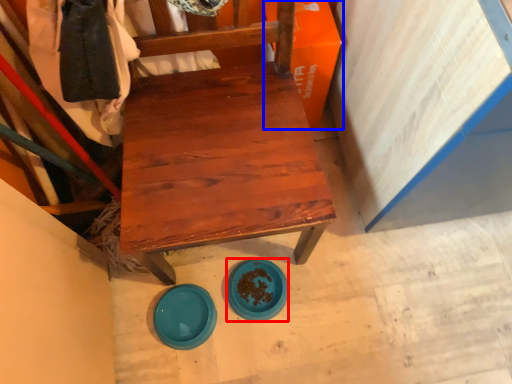
Question: Which of the following is the farthest to the observer, plate (highlighted by a red box) or cardboard box (highlighted by a blue box)?

Choices:
 (A) plate
 (B) cardboard box

Answer: (A)